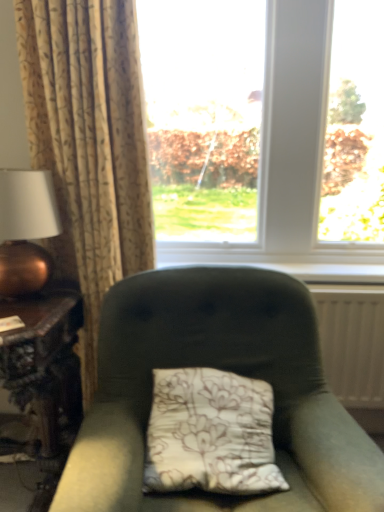
Question: From a real-world perspective, is beige floral fabric curtain at left located beneath white painted wood at center?

Choices:
 (A) no
 (B) yes

Answer: (A)

Question: Is beige floral fabric curtain at left looking in the opposite direction of white painted wood at center?

Choices:
 (A) no
 (B) yes

Answer: (A)

Question: Is beige floral fabric curtain at left to the left of white painted wood at center from the viewer's perspective?

Choices:
 (A) yes
 (B) no

Answer: (A)

Question: Does beige floral fabric curtain at left have a smaller size compared to white painted wood at center?

Choices:
 (A) yes
 (B) no

Answer: (B)

Question: Considering the relative sizes of beige floral fabric curtain at left and white painted wood at center in the image provided, is beige floral fabric curtain at left wider than white painted wood at center?

Choices:
 (A) yes
 (B) no

Answer: (A)

Question: Is velvet green chair at center taller or shorter than copper metallic table lamp at left?

Choices:
 (A) tall
 (B) short

Answer: (A)

Question: Does point (350, 484) appear closer or farther from the camera than point (48, 265)?

Choices:
 (A) farther
 (B) closer

Answer: (B)

Question: Would you say velvet green chair at center is to the left or to the right of copper metallic table lamp at left in the picture?

Choices:
 (A) right
 (B) left

Answer: (A)

Question: From the image's perspective, is velvet green chair at center located above or below copper metallic table lamp at left?

Choices:
 (A) above
 (B) below

Answer: (B)

Question: Which is correct: velvet green chair at center is inside transparent glass window at center, or outside of it?

Choices:
 (A) outside
 (B) inside

Answer: (A)

Question: Is velvet green chair at center taller or shorter than transparent glass window at center?

Choices:
 (A) tall
 (B) short

Answer: (B)

Question: Considering the positions of velvet green chair at center and transparent glass window at center in the image, is velvet green chair at center wider or thinner than transparent glass window at center?

Choices:
 (A) wide
 (B) thin

Answer: (A)

Question: Based on their sizes in the image, would you say velvet green chair at center is bigger or smaller than transparent glass window at center?

Choices:
 (A) big
 (B) small

Answer: (A)

Question: From their relative heights in the image, would you say beige floral fabric curtain at left is taller or shorter than copper metallic table lamp at left?

Choices:
 (A) short
 (B) tall

Answer: (B)

Question: Relative to copper metallic table lamp at left, is beige floral fabric curtain at left in front or behind?

Choices:
 (A) front
 (B) behind

Answer: (B)